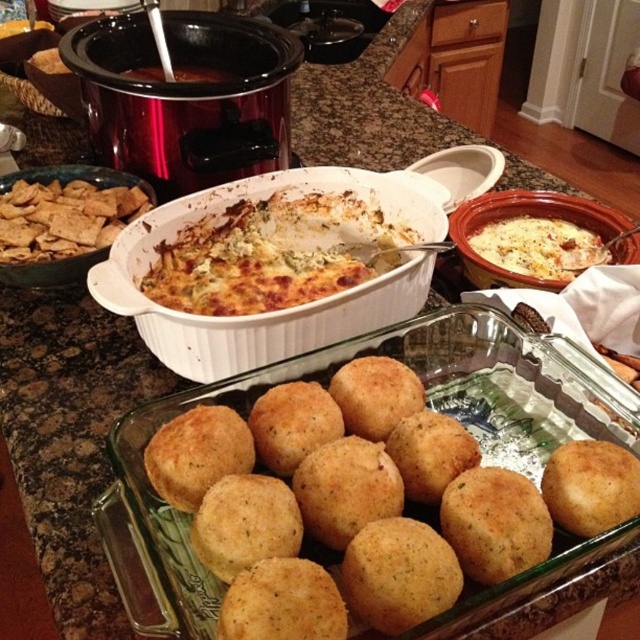
Question: Which point appears closest to the camera in this image?

Choices:
 (A) (561, 244)
 (B) (232, 269)

Answer: (B)

Question: Among these points, which one is nearest to the camera?

Choices:
 (A) (100, 243)
 (B) (326, 262)
 (C) (612, 452)

Answer: (C)

Question: Can you confirm if golden baked casserole at center is positioned below white creamy casserole at center-right?

Choices:
 (A) yes
 (B) no

Answer: (A)

Question: Is golden brown crumbly balls at center positioned at the back of brown cracker at left?

Choices:
 (A) no
 (B) yes

Answer: (A)

Question: Does golden brown crumbly balls at center come behind brown cracker at left?

Choices:
 (A) no
 (B) yes

Answer: (A)

Question: Which point is closer to the camera taking this photo?

Choices:
 (A) (326, 403)
 (B) (19, 188)

Answer: (A)